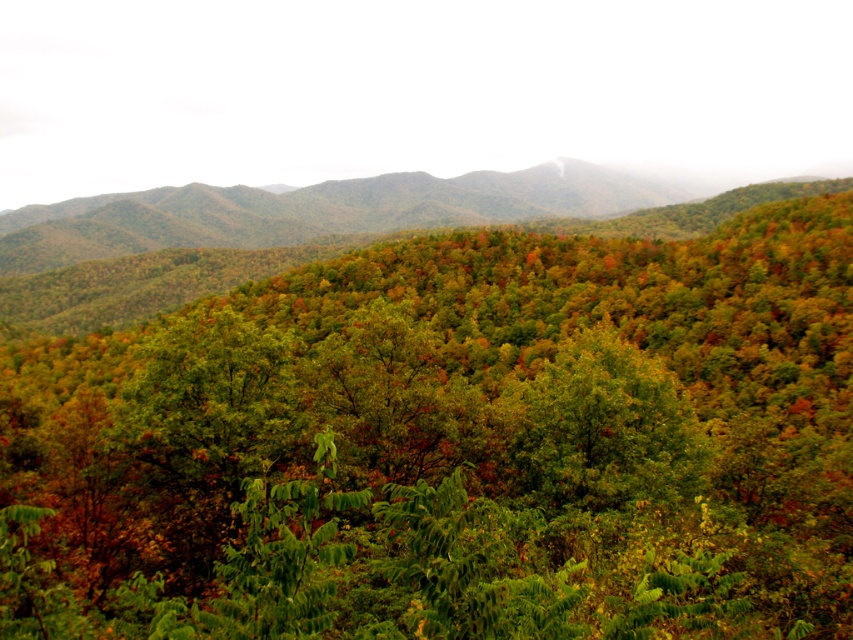
Is green matte tree at center smaller than green leafy forest at center?

Indeed, green matte tree at center has a smaller size compared to green leafy forest at center.

Which is more to the right, green matte tree at center or green leafy forest at center?

From the viewer's perspective, green matte tree at center appears more on the right side.

The height and width of the screenshot is (640, 853). I want to click on green matte tree at center, so click(454, 444).